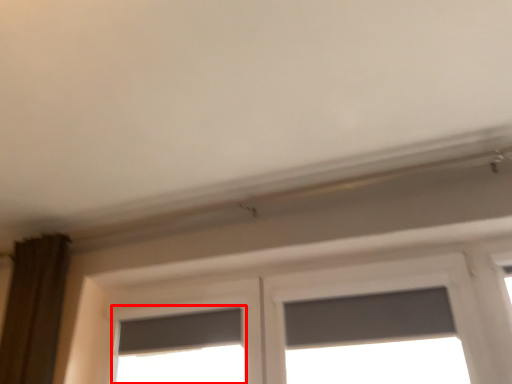
Question: Where is window (annotated by the red box) located in relation to window screen in the image?

Choices:
 (A) left
 (B) right

Answer: (A)